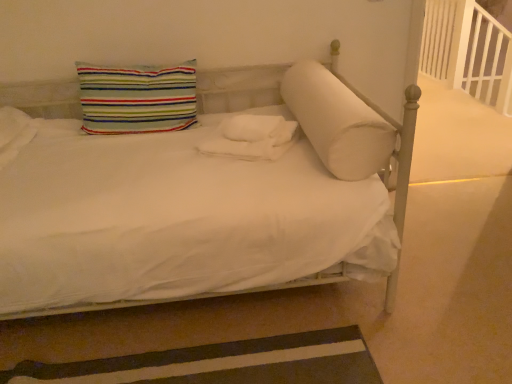
At what (x,y) coordinates should I click in order to perform the action: click on vacant area situated below brown striped rug at lower left (from a real-world perspective). Please return your answer as a coordinate pair (x, y). Looking at the image, I should click on (199, 367).